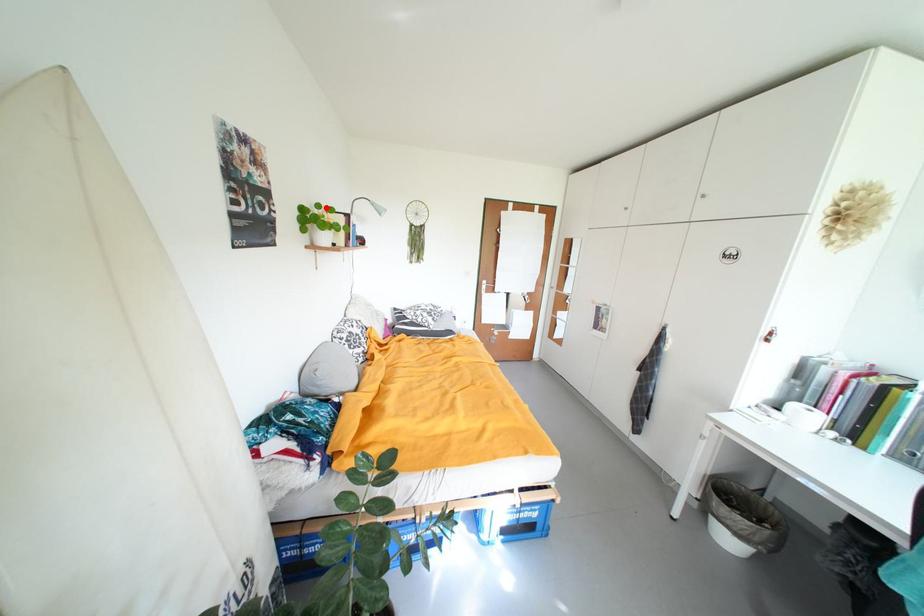
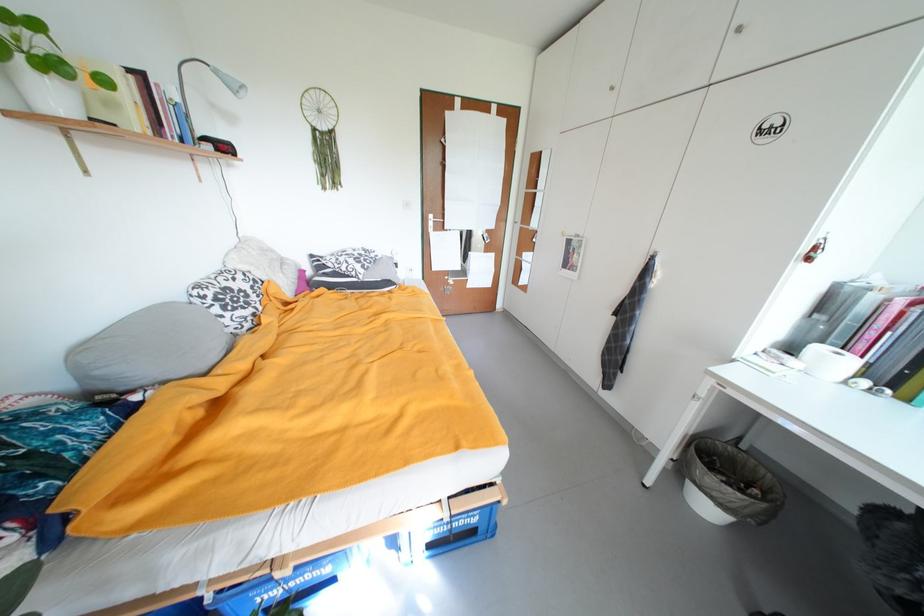
Locate, in the second image, the point that corresponds to the highlighted location in the first image.

(15, 18)